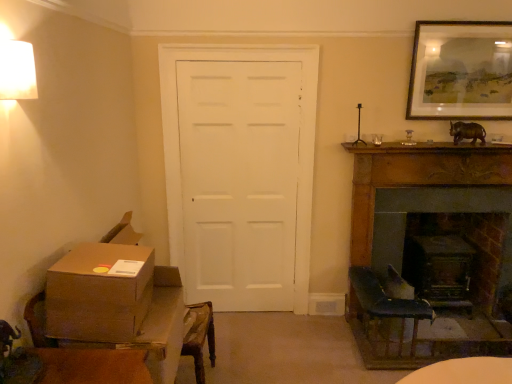
Describe the element at coordinates (98, 294) in the screenshot. The width and height of the screenshot is (512, 384). I see `brown cardboard box at lower left` at that location.

I want to click on dark wood fireplace at right, the 2th fireplace from the back, so click(x=429, y=245).

Is dark wood fireplace at right, placed as the 1th fireplace when sorted from front to back, beside brown cardboard box at lower left?

No, dark wood fireplace at right, placed as the 1th fireplace when sorted from front to back, is not touching brown cardboard box at lower left.

At what (x,y) coordinates should I click in order to perform the action: click on the 1st fireplace counting from the right side of the brown cardboard box at lower left. Please return your answer as a coordinate pair (x, y). The height and width of the screenshot is (384, 512). Looking at the image, I should click on (429, 245).

Does point (362, 265) come in front of point (160, 356)?

No, (362, 265) is further to viewer.

Considering the sizes of objects dark wood fireplace at right, the 2th fireplace from the back, and brown cardboard box at lower left in the image provided, who is wider, dark wood fireplace at right, the 2th fireplace from the back, or brown cardboard box at lower left?

With larger width is brown cardboard box at lower left.

The height and width of the screenshot is (384, 512). In order to click on fireplace lying below the brown cardboard box at lower left (from the image's perspective) in this screenshot , I will do [x=436, y=211].

Looking at this image, choose the correct answer: Is brown cardboard box at lower left inside dark wood fireplace at right, which is counted as the 2th fireplace, starting from the front, or outside it?

brown cardboard box at lower left lies outside dark wood fireplace at right, which is counted as the 2th fireplace, starting from the front.

Which object is closer to the camera, brown cardboard box at lower left or dark wood fireplace at right, acting as the first fireplace starting from the back?

brown cardboard box at lower left is in front.

Is brown cardboard box at lower left taller than dark wood fireplace at right, acting as the first fireplace starting from the back?

Incorrect, the height of brown cardboard box at lower left is not larger of that of dark wood fireplace at right, acting as the first fireplace starting from the back.

Is dark wood fireplace at right, acting as the first fireplace starting from the back, closer to camera compared to brown cardboard box at lower left?

No, it is not.

From the picture: Between dark wood fireplace at right, acting as the first fireplace starting from the back, and brown cardboard box at lower left, which one has less height?

With less height is brown cardboard box at lower left.

Does dark wood fireplace at right, which is counted as the 2th fireplace, starting from the front, have a larger size compared to brown cardboard box at lower left?

Yes, dark wood fireplace at right, which is counted as the 2th fireplace, starting from the front, is bigger than brown cardboard box at lower left.

Can you confirm if dark wood fireplace at right, which is counted as the 2th fireplace, starting from the front, is positioned to the left of brown cardboard box at lower left?

In fact, dark wood fireplace at right, which is counted as the 2th fireplace, starting from the front, is to the right of brown cardboard box at lower left.

Is point (255, 285) farther from camera compared to point (449, 154)?

Yes, it is.

Consider the image. From the image's perspective, is white matte door at center beneath dark wood fireplace at right, placed as the 1th fireplace when sorted from front to back?

Incorrect, from the image's perspective, white matte door at center is higher than dark wood fireplace at right, placed as the 1th fireplace when sorted from front to back.

Which of these two, white matte door at center or dark wood fireplace at right, the 2th fireplace from the back, stands shorter?

dark wood fireplace at right, the 2th fireplace from the back.

In the scene shown: Is white matte door at center facing away from dark wood fireplace at right, placed as the 1th fireplace when sorted from front to back?

No, white matte door at center is not facing the opposite direction of dark wood fireplace at right, placed as the 1th fireplace when sorted from front to back.

Which point is more forward, (251, 81) or (77, 270)?

The point (77, 270) is closer.

From a real-world perspective, is white matte door at center positioned under brown cardboard box at lower left based on gravity?

No.

Does white matte door at center touch brown cardboard box at lower left?

No.

Considering the sizes of white matte door at center and brown cardboard box at lower left in the image, is white matte door at center bigger or smaller than brown cardboard box at lower left?

Clearly, white matte door at center is larger in size than brown cardboard box at lower left.

Can you confirm if white matte door at center is taller than brown cardboard box at lower left?

Yes.

Could you tell me if white matte door at center is turned towards brown cardboard box at lower left?

Yes, white matte door at center is oriented towards brown cardboard box at lower left.

Locate an element on the screen. table in front of the white matte door at center is located at coordinates (134, 330).

In terms of size, does white matte door at center appear bigger or smaller than brown cardboard box at lower left?

In the image, white matte door at center appears to be larger than brown cardboard box at lower left.

In the scene shown: Can you confirm if dark wood fireplace at right, placed as the 1th fireplace when sorted from front to back, is positioned to the left of brown cardboard box at lower left?

No, dark wood fireplace at right, placed as the 1th fireplace when sorted from front to back, is not to the left of brown cardboard box at lower left.

What's the angular difference between dark wood fireplace at right, the 2th fireplace from the back, and brown cardboard box at lower left's facing directions?

93.7 degrees.

Which is further, (410,353) or (150,299)?

The point (410,353) is farther from the camera.

From the image's perspective, who appears lower, dark wood fireplace at right, placed as the 1th fireplace when sorted from front to back, or brown cardboard box at lower left?

brown cardboard box at lower left.

Identify the location of the 1st fireplace behind the brown cardboard box at lower left, starting your count from the anchor. Image resolution: width=512 pixels, height=384 pixels. (429, 245).

Locate an element on the screen. This screenshot has width=512, height=384. box above the dark wood fireplace at right, which is counted as the 2th fireplace, starting from the front (from the image's perspective) is located at coordinates (98, 294).

Which object lies further to the anchor point brown cardboard box at lower left, brown cardboard box at lower left or white matte door at center?

Among the two, white matte door at center is located further to brown cardboard box at lower left.

Looking at this image, based on their spatial positions, is dark wood fireplace at right, acting as the first fireplace starting from the back, or brown cardboard box at lower left closer to dark wood fireplace at right, the 2th fireplace from the back?

The object closer to dark wood fireplace at right, the 2th fireplace from the back, is dark wood fireplace at right, acting as the first fireplace starting from the back.

Estimate the real-world distances between objects in this image. Which object is further from dark wood fireplace at right, placed as the 1th fireplace when sorted from front to back, wooden framed artwork at upper right or dark wood fireplace at right, which is counted as the 2th fireplace, starting from the front?

wooden framed artwork at upper right is positioned further to the anchor dark wood fireplace at right, placed as the 1th fireplace when sorted from front to back.

When comparing their distances from dark wood fireplace at right, the 2th fireplace from the back, does dark wood fireplace at right, which is counted as the 2th fireplace, starting from the front, or brown cardboard box at lower left seem further?

brown cardboard box at lower left.

From the image, which object appears to be farther from wooden framed artwork at upper right, white matte door at center or dark wood fireplace at right, the 2th fireplace from the back?

white matte door at center is positioned further to the anchor wooden framed artwork at upper right.

Estimate the real-world distances between objects in this image. Which object is closer to wooden framed artwork at upper right, white matte door at center or brown cardboard box at lower left?

white matte door at center lies closer to wooden framed artwork at upper right than the other object.

Estimate the real-world distances between objects in this image. Which object is further from brown cardboard box at lower left, dark wood fireplace at right, the 2th fireplace from the back, or brown cardboard box at lower left?

Among the two, dark wood fireplace at right, the 2th fireplace from the back, is located further to brown cardboard box at lower left.

Which object lies nearer to the anchor point brown cardboard box at lower left, dark wood fireplace at right, acting as the first fireplace starting from the back, or dark wood fireplace at right, the 2th fireplace from the back?

dark wood fireplace at right, the 2th fireplace from the back, is closer to brown cardboard box at lower left.

You are a GUI agent. You are given a task and a screenshot of the screen. Output one action in this format:
    pyautogui.click(x=<x>, y=<y>)
    Task: Click on the table located between brown cardboard box at lower left and white matte door at center in the depth direction
    The image size is (512, 384).
    Given the screenshot: What is the action you would take?
    pyautogui.click(x=134, y=330)

This screenshot has height=384, width=512. Find the location of `fireplace located between brown cardboard box at lower left and wooden framed artwork at upper right in the left-right direction`. fireplace located between brown cardboard box at lower left and wooden framed artwork at upper right in the left-right direction is located at coordinates [429, 245].

The height and width of the screenshot is (384, 512). Identify the location of fireplace between brown cardboard box at lower left and dark wood fireplace at right, acting as the first fireplace starting from the back, in the horizontal direction. (429, 245).

This screenshot has width=512, height=384. In order to click on door between brown cardboard box at lower left and dark wood fireplace at right, acting as the first fireplace starting from the back in this screenshot , I will do `click(240, 172)`.